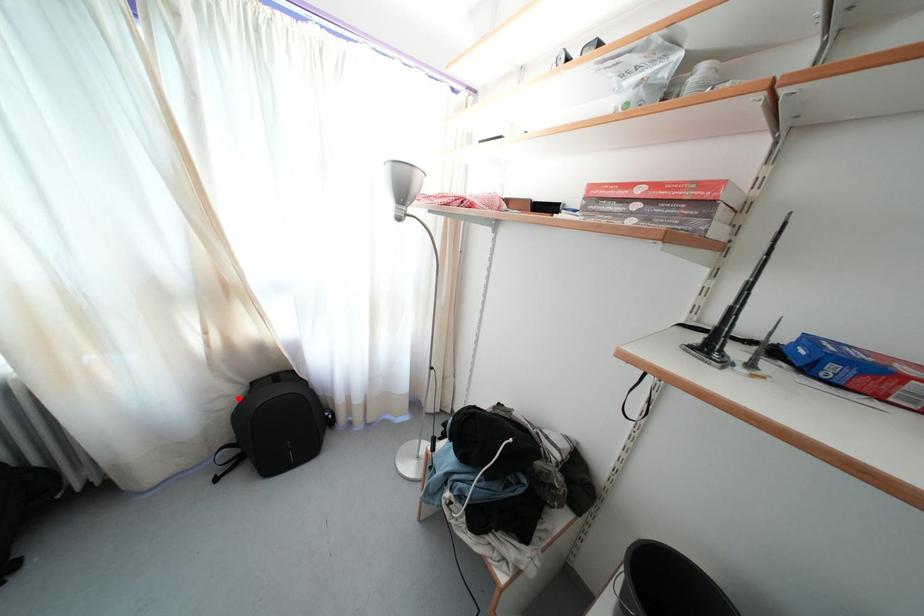
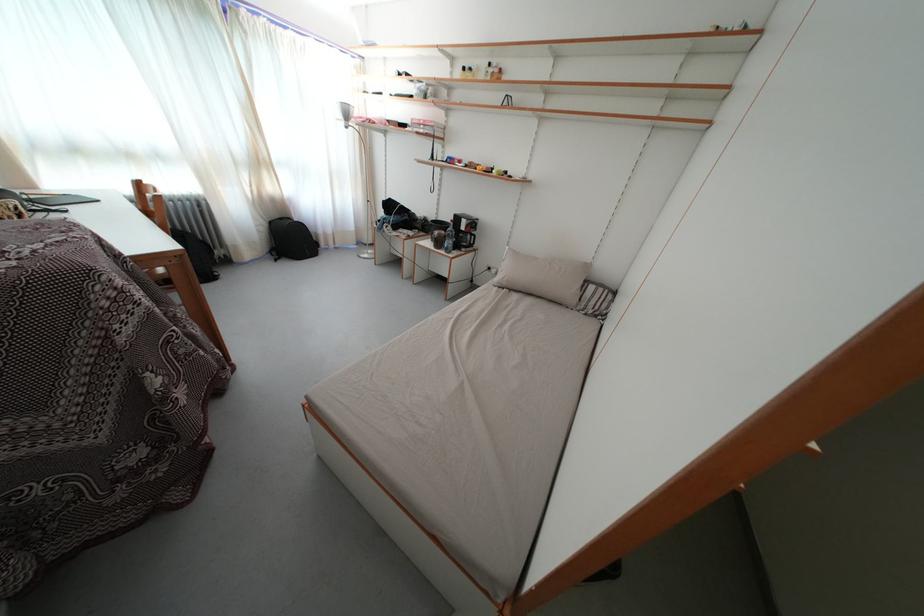
Locate, in the second image, the point that corresponds to the highlighted location in the first image.

(272, 230)